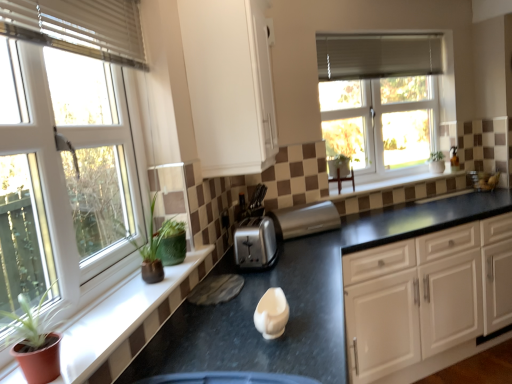
This screenshot has width=512, height=384. I want to click on free location in front of green matte plant at left, so click(121, 306).